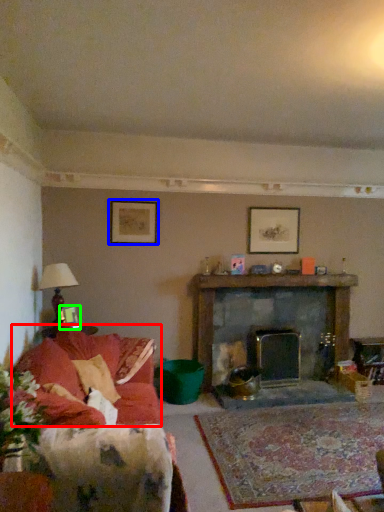
Question: Which object is positioned farthest from couch (highlighted by a red box)? Select from picture frame (highlighted by a blue box) and picture frame (highlighted by a green box).

Choices:
 (A) picture frame
 (B) picture frame

Answer: (A)